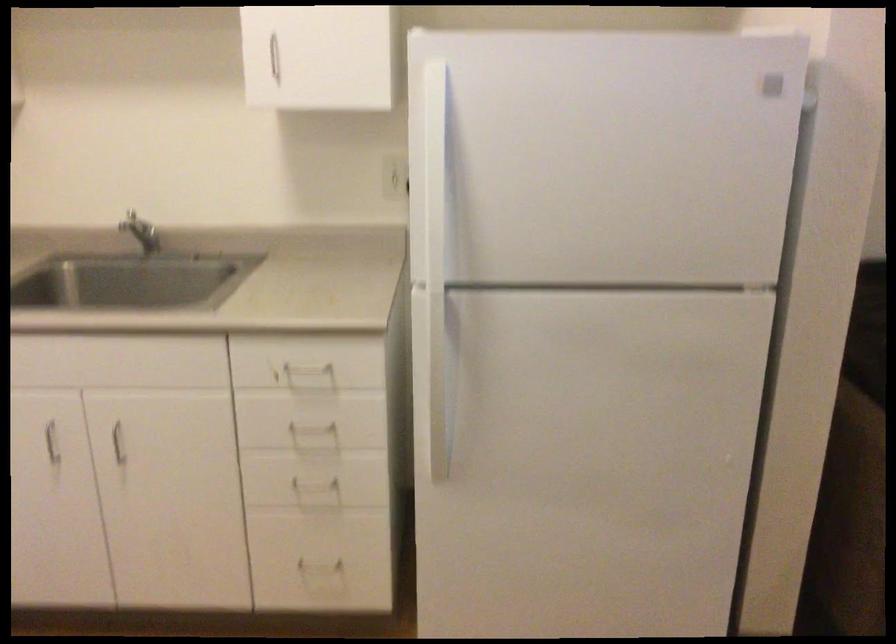
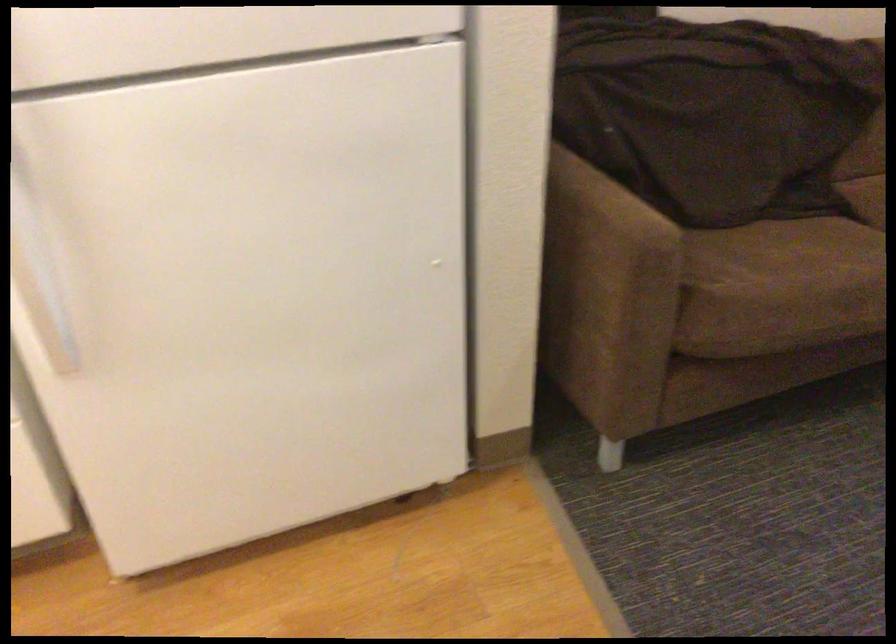
Based on the photo, how did the camera likely rotate?

The rotation direction of the camera is right-down.